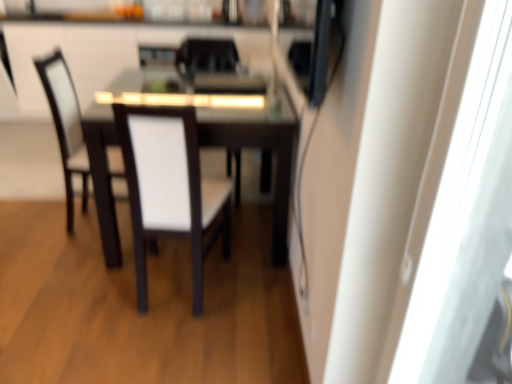
Where is `free space to the left of dark wood table at center`? free space to the left of dark wood table at center is located at coordinates click(42, 229).